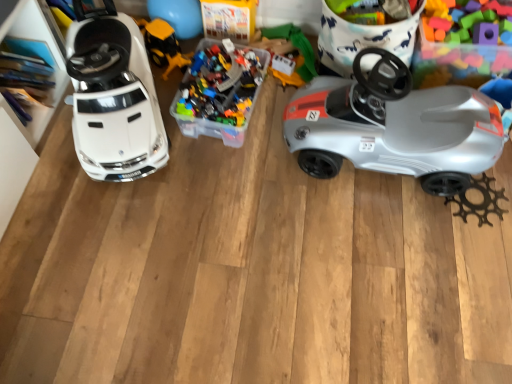
Measure the distance between point (98, 31) and camera.

A distance of 1.30 meters exists between point (98, 31) and camera.

Identify the location of white glossy car at left, the 1th toy from the left. The width and height of the screenshot is (512, 384). (113, 97).

Would you say white glossy car at left, the 4th toy viewed from the right, is inside or outside yellow plastic construction vehicle at center, which ranks as the 2th toy in left-to-right order?

white glossy car at left, the 4th toy viewed from the right, lies outside yellow plastic construction vehicle at center, which ranks as the 2th toy in left-to-right order.

Is white glossy car at left, the 1th toy from the left, to the right of yellow plastic construction vehicle at center, which ranks as the 2th toy in left-to-right order, from the viewer's perspective?

In fact, white glossy car at left, the 1th toy from the left, is to the left of yellow plastic construction vehicle at center, which ranks as the 2th toy in left-to-right order.

Between white glossy car at left, the 4th toy viewed from the right, and yellow plastic construction vehicle at center, positioned as the third toy in right-to-left order, which one is positioned in front?

white glossy car at left, the 4th toy viewed from the right, is closer to the camera.

Is white glossy car at left, the 4th toy viewed from the right, completely or partially outside of translucent plastic blocks at upper right, the fourth toy in the left-to-right sequence?

Indeed, white glossy car at left, the 4th toy viewed from the right, is completely outside translucent plastic blocks at upper right, the fourth toy in the left-to-right sequence.

From the white glossy car at left, the 1th toy from the left, count 3rd toy to the right and point to it. Please provide its 2D coordinates.

[(463, 42)]

How distant is white glossy car at left, the 1th toy from the left, from translucent plastic blocks at upper right, positioned as the 1th toy in right-to-left order?

white glossy car at left, the 1th toy from the left, is 1.07 meters from translucent plastic blocks at upper right, positioned as the 1th toy in right-to-left order.

Does white glossy car at left, the 1th toy from the left, touch translucent plastic blocks at upper right, the fourth toy in the left-to-right sequence?

white glossy car at left, the 1th toy from the left, and translucent plastic blocks at upper right, the fourth toy in the left-to-right sequence, are not in contact.

This screenshot has width=512, height=384. Find the location of `car in front of the translucent plastic container at center, arranged as the 2th toy when viewed from the right`. car in front of the translucent plastic container at center, arranged as the 2th toy when viewed from the right is located at coordinates (394, 126).

From their relative heights in the image, would you say translucent plastic container at center, positioned as the 3th toy in left-to-right order, is taller or shorter than silver plastic car at right?

translucent plastic container at center, positioned as the 3th toy in left-to-right order, is shorter than silver plastic car at right.

Based on the photo, how much distance is there between translucent plastic container at center, arranged as the 2th toy when viewed from the right, and silver plastic car at right?

translucent plastic container at center, arranged as the 2th toy when viewed from the right, is 16.07 inches from silver plastic car at right.

Consider the image. Considering the sizes of objects translucent plastic container at center, arranged as the 2th toy when viewed from the right, and silver plastic car at right in the image provided, who is thinner, translucent plastic container at center, arranged as the 2th toy when viewed from the right, or silver plastic car at right?

silver plastic car at right is thinner.

Is translucent plastic blocks at upper right, positioned as the 1th toy in right-to-left order, inside translucent plastic container at center, positioned as the 3th toy in left-to-right order?

No, translucent plastic blocks at upper right, positioned as the 1th toy in right-to-left order, is not inside translucent plastic container at center, positioned as the 3th toy in left-to-right order.

Is point (231, 58) more distant than point (507, 51)?

Yes, it is behind point (507, 51).

Does translucent plastic container at center, arranged as the 2th toy when viewed from the right, come in front of translucent plastic blocks at upper right, positioned as the 1th toy in right-to-left order?

No, translucent plastic container at center, arranged as the 2th toy when viewed from the right, is further to the viewer.

Looking at the image, does translucent plastic container at center, positioned as the 3th toy in left-to-right order, seem bigger or smaller compared to translucent plastic blocks at upper right, positioned as the 1th toy in right-to-left order?

Clearly, translucent plastic container at center, positioned as the 3th toy in left-to-right order, is smaller in size than translucent plastic blocks at upper right, positioned as the 1th toy in right-to-left order.

Is yellow plastic construction vehicle at center, which ranks as the 2th toy in left-to-right order, oriented towards translucent plastic container at center, positioned as the 3th toy in left-to-right order?

Yes.

Is yellow plastic construction vehicle at center, positioned as the third toy in right-to-left order, placed right next to translucent plastic container at center, arranged as the 2th toy when viewed from the right?

No, yellow plastic construction vehicle at center, positioned as the third toy in right-to-left order, is not in contact with translucent plastic container at center, arranged as the 2th toy when viewed from the right.

From the image's perspective, would you say yellow plastic construction vehicle at center, positioned as the third toy in right-to-left order, is shown under translucent plastic container at center, positioned as the 3th toy in left-to-right order?

Actually, yellow plastic construction vehicle at center, positioned as the third toy in right-to-left order, appears above translucent plastic container at center, positioned as the 3th toy in left-to-right order, in the image.

Which object is thinner, yellow plastic construction vehicle at center, which ranks as the 2th toy in left-to-right order, or translucent plastic container at center, arranged as the 2th toy when viewed from the right?

Thinner between the two is yellow plastic construction vehicle at center, which ranks as the 2th toy in left-to-right order.

Between translucent plastic blocks at upper right, the fourth toy in the left-to-right sequence, and silver plastic car at right, which one has larger size?

silver plastic car at right is bigger.

Does translucent plastic blocks at upper right, the fourth toy in the left-to-right sequence, touch silver plastic car at right?

translucent plastic blocks at upper right, the fourth toy in the left-to-right sequence, and silver plastic car at right are not in contact.

From the image's perspective, is translucent plastic blocks at upper right, the fourth toy in the left-to-right sequence, positioned above or below silver plastic car at right?

Clearly, from the image's perspective, translucent plastic blocks at upper right, the fourth toy in the left-to-right sequence, is above silver plastic car at right.

Is point (450, 49) closer to camera compared to point (353, 154)?

No, (450, 49) is behind (353, 154).

Can you confirm if yellow plastic construction vehicle at center, which ranks as the 2th toy in left-to-right order, is thinner than silver plastic car at right?

Correct, the width of yellow plastic construction vehicle at center, which ranks as the 2th toy in left-to-right order, is less than that of silver plastic car at right.

From the silver plastic car at right, count 4th toys backward and point to it. Please provide its 2D coordinates.

[(163, 45)]

From the image's perspective, would you say yellow plastic construction vehicle at center, positioned as the third toy in right-to-left order, is shown under silver plastic car at right?

Actually, yellow plastic construction vehicle at center, positioned as the third toy in right-to-left order, appears above silver plastic car at right in the image.

What's the angular difference between yellow plastic construction vehicle at center, which ranks as the 2th toy in left-to-right order, and silver plastic car at right's facing directions?

56.1 degrees.

Find the location of a particular element. the 3rd toy below the white glossy car at left, the 1th toy from the left (from a real-world perspective) is located at coordinates (163, 45).

From the white glossy car at left, the 1th toy from the left, count 3rd toy to the right and point to it. Please provide its 2D coordinates.

[(463, 42)]

Estimate the real-world distances between objects in this image. Which object is further from translucent plastic blocks at upper right, positioned as the 1th toy in right-to-left order, white glossy car at left, the 4th toy viewed from the right, or silver plastic car at right?

white glossy car at left, the 4th toy viewed from the right, is positioned further to the anchor translucent plastic blocks at upper right, positioned as the 1th toy in right-to-left order.

From the image, which object appears to be farther from white glossy car at left, the 4th toy viewed from the right, silver plastic car at right or translucent plastic container at center, arranged as the 2th toy when viewed from the right?

Among the two, silver plastic car at right is located further to white glossy car at left, the 4th toy viewed from the right.

Which object lies nearer to the anchor point translucent plastic container at center, arranged as the 2th toy when viewed from the right, white glossy car at left, the 1th toy from the left, or yellow plastic construction vehicle at center, positioned as the third toy in right-to-left order?

Among the two, white glossy car at left, the 1th toy from the left, is located nearer to translucent plastic container at center, arranged as the 2th toy when viewed from the right.

From the image, which object appears to be farther from yellow plastic construction vehicle at center, positioned as the third toy in right-to-left order, translucent plastic blocks at upper right, the fourth toy in the left-to-right sequence, or white glossy car at left, the 4th toy viewed from the right?

Based on the image, translucent plastic blocks at upper right, the fourth toy in the left-to-right sequence, appears to be further to yellow plastic construction vehicle at center, positioned as the third toy in right-to-left order.

Considering their positions, is silver plastic car at right positioned closer to translucent plastic blocks at upper right, positioned as the 1th toy in right-to-left order, than white glossy car at left, the 4th toy viewed from the right?

silver plastic car at right.

Which object lies nearer to the anchor point translucent plastic container at center, positioned as the 3th toy in left-to-right order, white glossy car at left, the 1th toy from the left, or silver plastic car at right?

Among the two, white glossy car at left, the 1th toy from the left, is located nearer to translucent plastic container at center, positioned as the 3th toy in left-to-right order.

Considering their positions, is translucent plastic blocks at upper right, positioned as the 1th toy in right-to-left order, positioned closer to silver plastic car at right than yellow plastic construction vehicle at center, positioned as the third toy in right-to-left order?

translucent plastic blocks at upper right, positioned as the 1th toy in right-to-left order, is closer to silver plastic car at right.

Which object lies further to the anchor point white glossy car at left, the 4th toy viewed from the right, translucent plastic blocks at upper right, the fourth toy in the left-to-right sequence, or translucent plastic container at center, positioned as the 3th toy in left-to-right order?

Based on the image, translucent plastic blocks at upper right, the fourth toy in the left-to-right sequence, appears to be further to white glossy car at left, the 4th toy viewed from the right.

The width and height of the screenshot is (512, 384). Identify the location of toy between yellow plastic construction vehicle at center, positioned as the third toy in right-to-left order, and silver plastic car at right, in the horizontal direction. (221, 84).

At what (x,y) coordinates should I click in order to perform the action: click on toy between yellow plastic construction vehicle at center, positioned as the third toy in right-to-left order, and translucent plastic blocks at upper right, positioned as the 1th toy in right-to-left order, from left to right. Please return your answer as a coordinate pair (x, y). The height and width of the screenshot is (384, 512). Looking at the image, I should click on (221, 84).

The height and width of the screenshot is (384, 512). I want to click on car between translucent plastic container at center, arranged as the 2th toy when viewed from the right, and translucent plastic blocks at upper right, positioned as the 1th toy in right-to-left order, from left to right, so click(394, 126).

In order to click on car situated between white glossy car at left, the 1th toy from the left, and translucent plastic blocks at upper right, positioned as the 1th toy in right-to-left order, from left to right in this screenshot , I will do `click(394, 126)`.